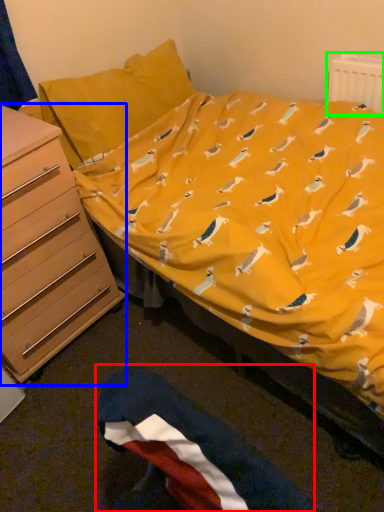
Question: Estimate the real-world distances between objects in this image. Which object is farther from flag (highlighted by a red box), chest of drawers (highlighted by a blue box) or radiator (highlighted by a green box)?

Choices:
 (A) chest of drawers
 (B) radiator

Answer: (B)